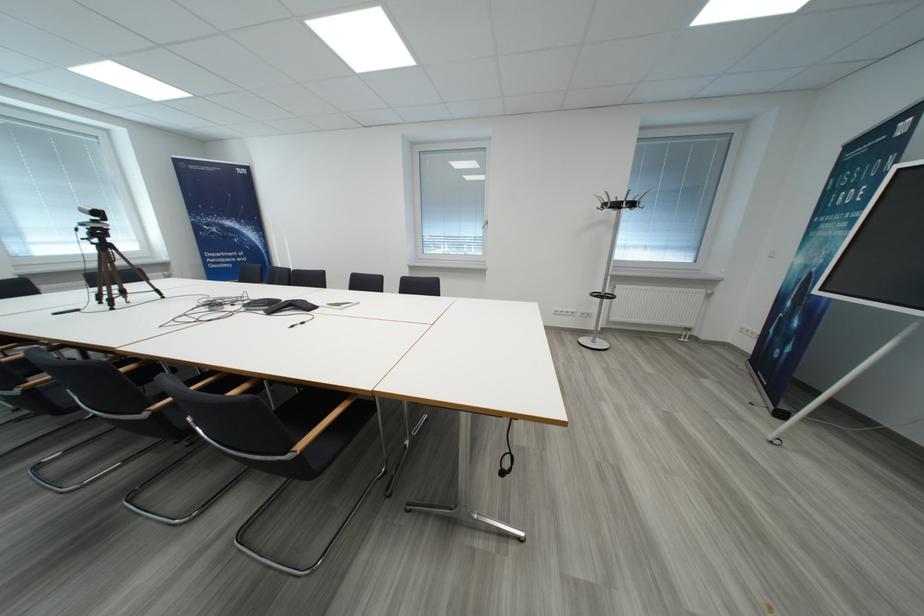
Image resolution: width=924 pixels, height=616 pixels. Identify the location of tripod adjustment handle. (68, 310).